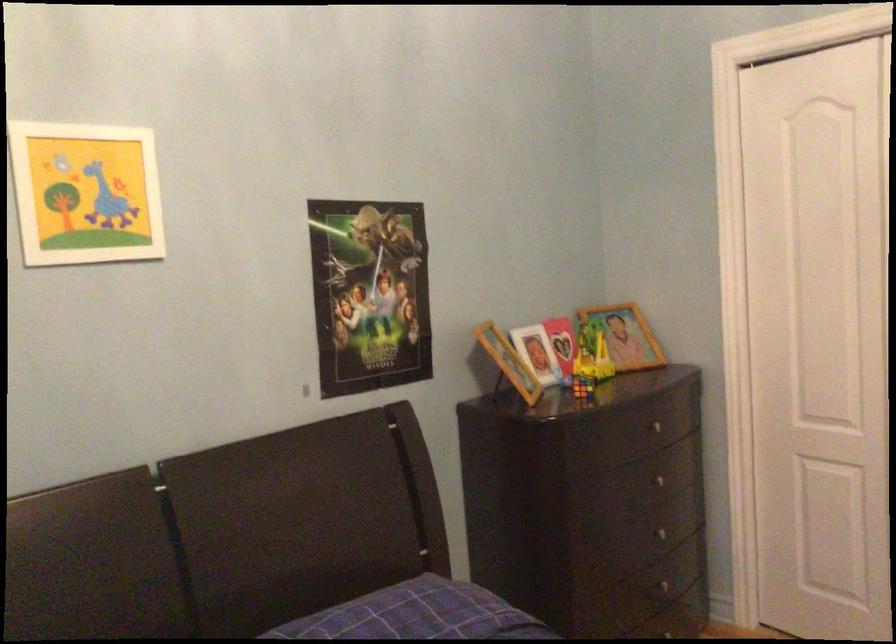
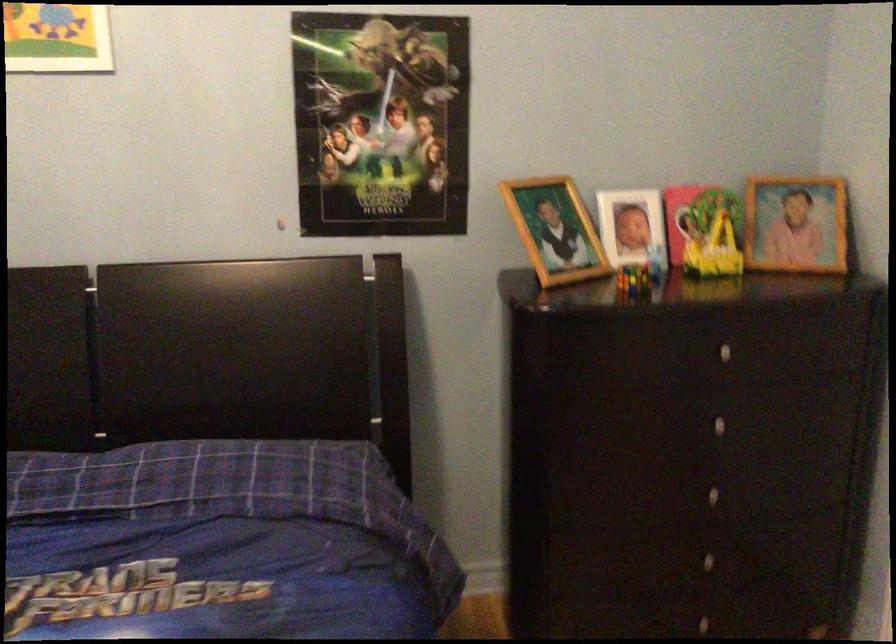
Locate, in the second image, the point that corresponds to (x=627, y=339) in the first image.

(796, 223)